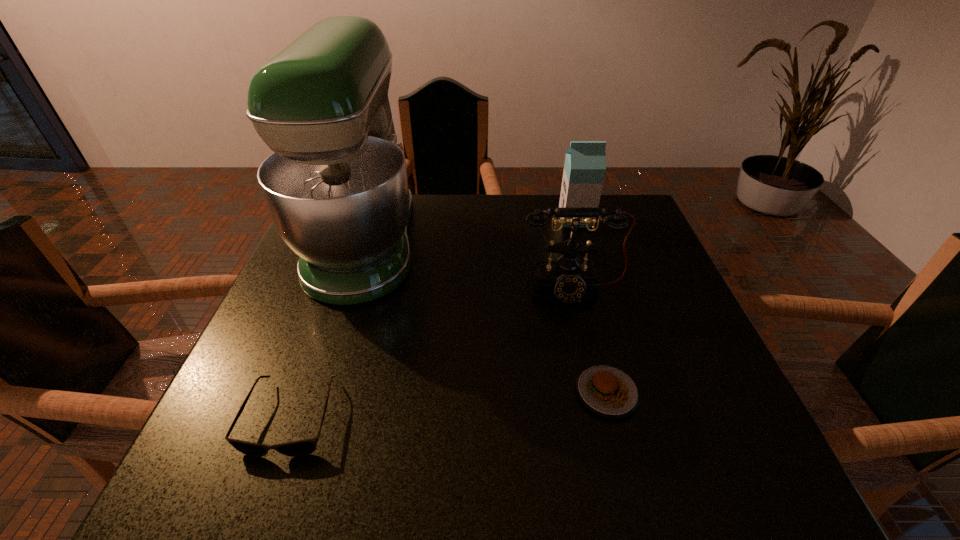
What are the coordinates of `mixer` in the screenshot? It's located at (336, 186).

The height and width of the screenshot is (540, 960). Identify the location of milk carton. (585, 162).

In order to click on telephone in this screenshot , I will do `click(568, 278)`.

This screenshot has width=960, height=540. In order to click on sunglasses in this screenshot , I will do `click(304, 447)`.

Image resolution: width=960 pixels, height=540 pixels. I want to click on food, so click(x=606, y=390).

Find the location of a particular element. blank area located 0.230m on the controls of the mixer is located at coordinates (509, 243).

Locate an element on the screen. Image resolution: width=960 pixels, height=540 pixels. vacant space located 0.140m on the left of the milk carton is located at coordinates (511, 219).

Identify the location of vacant space situated on the dial of the telephone. The image size is (960, 540). (581, 325).

Locate an element on the screen. This screenshot has height=540, width=960. vacant area situated on the back of the food is located at coordinates (588, 318).

Identify the location of mixer at the far edge. (336, 186).